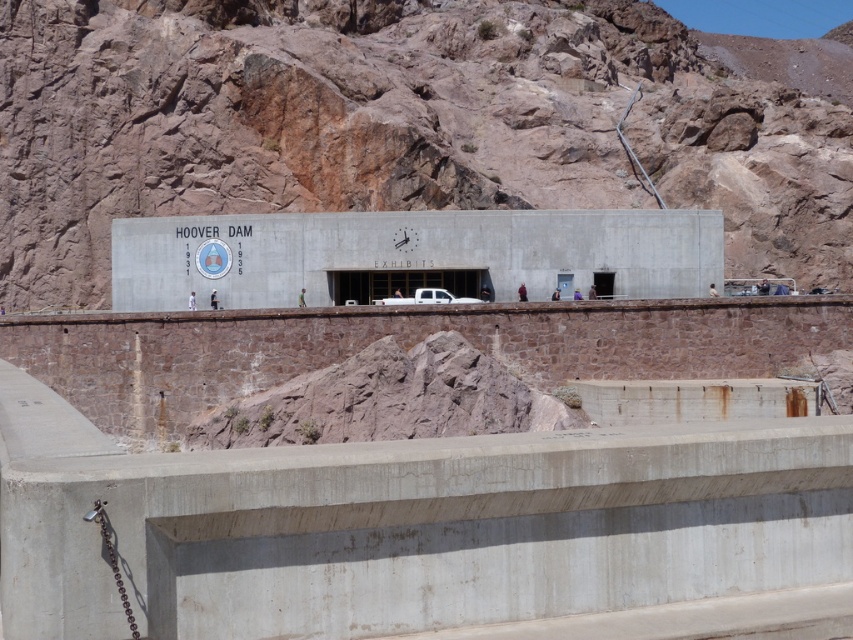
Question: Can you confirm if rustic rock mountain at upper center is positioned to the left of white matte truck at center?

Choices:
 (A) yes
 (B) no

Answer: (B)

Question: Which of the following is the closest to the observer?

Choices:
 (A) (405, 304)
 (B) (44, 58)

Answer: (A)

Question: Can you confirm if rustic rock mountain at upper center is positioned to the left of white matte truck at center?

Choices:
 (A) no
 (B) yes

Answer: (A)

Question: Is rustic rock mountain at upper center further to the viewer compared to white matte truck at center?

Choices:
 (A) yes
 (B) no

Answer: (A)